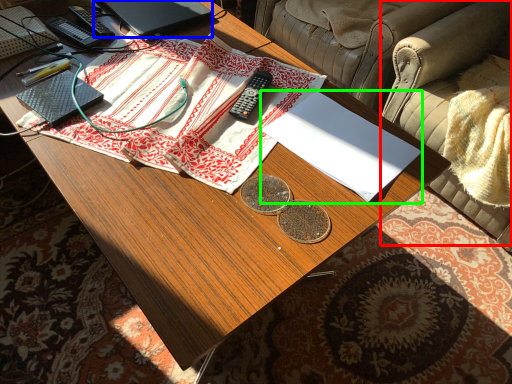
Question: Estimate the real-world distances between objects in this image. Which object is farther from armchair (highlighted by a red box), laptop (highlighted by a blue box) or notebook (highlighted by a green box)?

Choices:
 (A) laptop
 (B) notebook

Answer: (A)